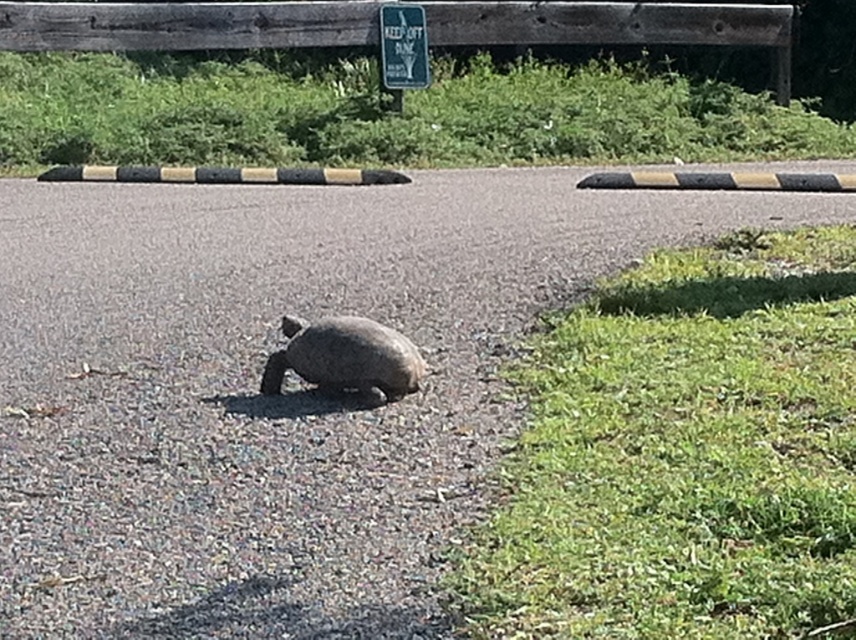
Question: From the image, what is the correct spatial relationship of brown matte tortoise at center in relation to green plastic sign at upper center?

Choices:
 (A) below
 (B) above

Answer: (A)

Question: Which object appears closest to the camera in this image?

Choices:
 (A) brown matte tortoise at center
 (B) green plastic sign at upper center

Answer: (A)

Question: Which point appears farthest from the camera in this image?

Choices:
 (A) (388, 81)
 (B) (372, 336)

Answer: (A)

Question: Can you confirm if brown matte tortoise at center is positioned to the right of green plastic sign at upper center?

Choices:
 (A) no
 (B) yes

Answer: (A)

Question: Does brown matte tortoise at center lie in front of green plastic sign at upper center?

Choices:
 (A) yes
 (B) no

Answer: (A)